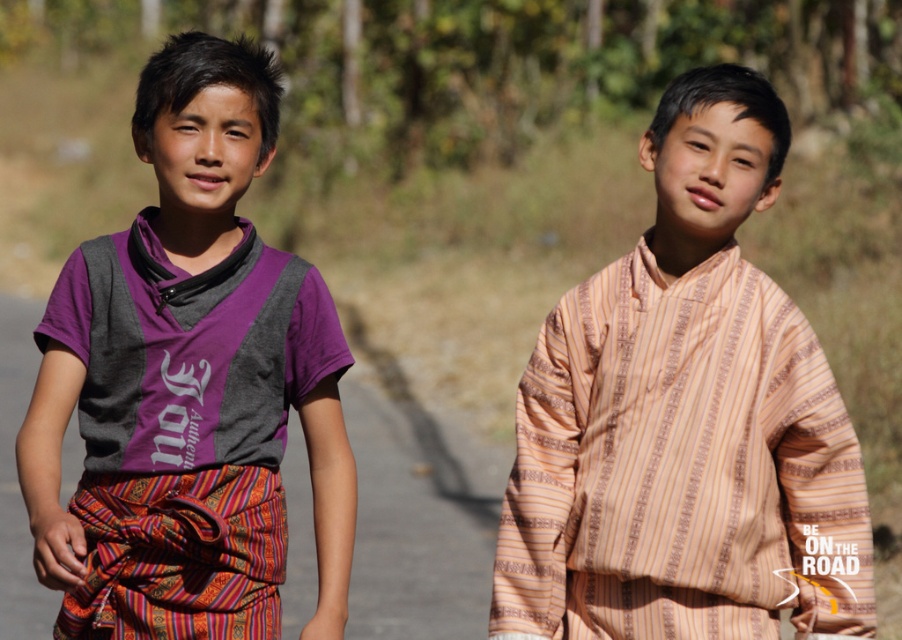
You are a photographer who wants to capture a group photo of the striped cotton shirt at center and the purple cotton shirt at center. Since you want both shirts to be clearly visible in the photo, which shirt should you focus on to ensure both are in focus?

Result: The striped cotton shirt at center is positioned on the right side of purple cotton shirt at center. To ensure both shirts are in focus, you should focus on the purple cotton shirt at center because it is closer to the camera, and the striped cotton shirt at center will also be in focus due to its proximity.

You are standing at point point (641, 417) and want to take a photo of the two young individuals standing outdoors. The camera you have can focus on subjects within 5 meters. Will the camera be able to capture them clearly?

The distance between point (641, 417) and the camera is 4.64 meters, which is within the camera focus range of 5 meters. Therefore, the camera can capture the subjects clearly.

You are a photographer trying to capture a group photo of two people wearing striped cotton shirt at center and purple cotton shirt at center. The minimum distance required for your camera to focus clearly is 1 meter. Based on the scene, will the camera be able to focus on both subjects simultaneously?

The striped cotton shirt at center is 88.13 centimeters from the purple cotton shirt at center. Since the minimum focusing distance required is 1 meter, the camera cannot focus on both subjects simultaneously because the distance between them is less than the required focusing distance.